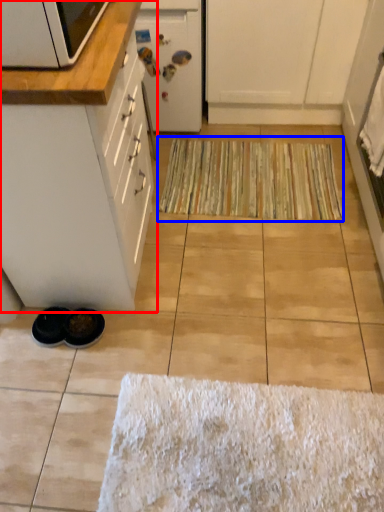
Question: Which of the following is the closest to the observer, cabinetry (highlighted by a red box) or doormat (highlighted by a blue box)?

Choices:
 (A) cabinetry
 (B) doormat

Answer: (A)